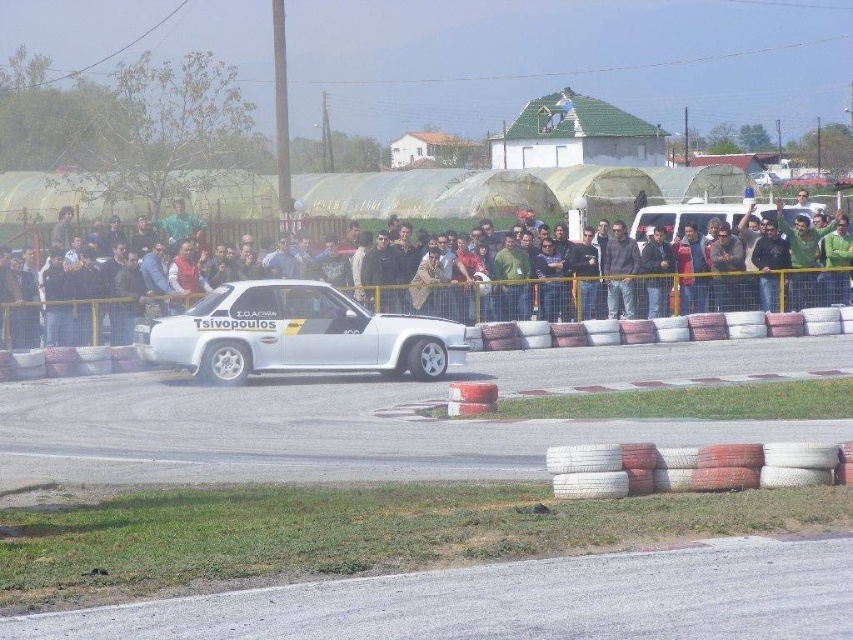
Question: Does white rubber tire at center have a smaller size compared to silver metallic tire at center?

Choices:
 (A) no
 (B) yes

Answer: (A)

Question: Which is nearer to the white rubber tire at center?

Choices:
 (A) white glossy car at center
 (B) white matte car at center
 (C) silver metallic tire at center

Answer: (A)

Question: Does white rubber tire at center have a smaller size compared to silver metallic tire at center?

Choices:
 (A) yes
 (B) no

Answer: (B)

Question: Can you confirm if white matte car at center is positioned to the left of white rubber tire at center?

Choices:
 (A) yes
 (B) no

Answer: (B)

Question: Which point is farther to the camera?

Choices:
 (A) (199, 372)
 (B) (270, 342)

Answer: (B)

Question: Which point is closer to the camera?

Choices:
 (A) [178, 339]
 (B) [230, 381]

Answer: (A)